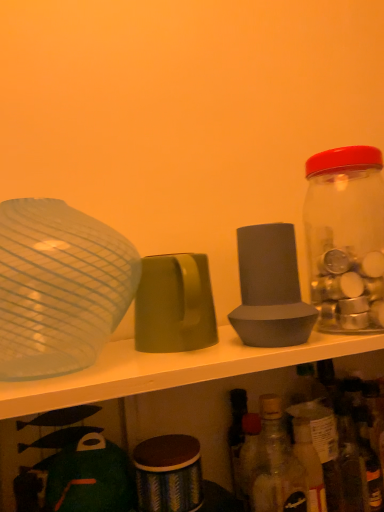
You are a GUI agent. You are given a task and a screenshot of the screen. Output one action in this format:
    pyautogui.click(x=<x>, y=<y>)
    Task: Click on the free space to the left of matte green cup at center, the 2th tableware positioned from the right
    This screenshot has height=512, width=384.
    Given the screenshot: What is the action you would take?
    pyautogui.click(x=100, y=354)